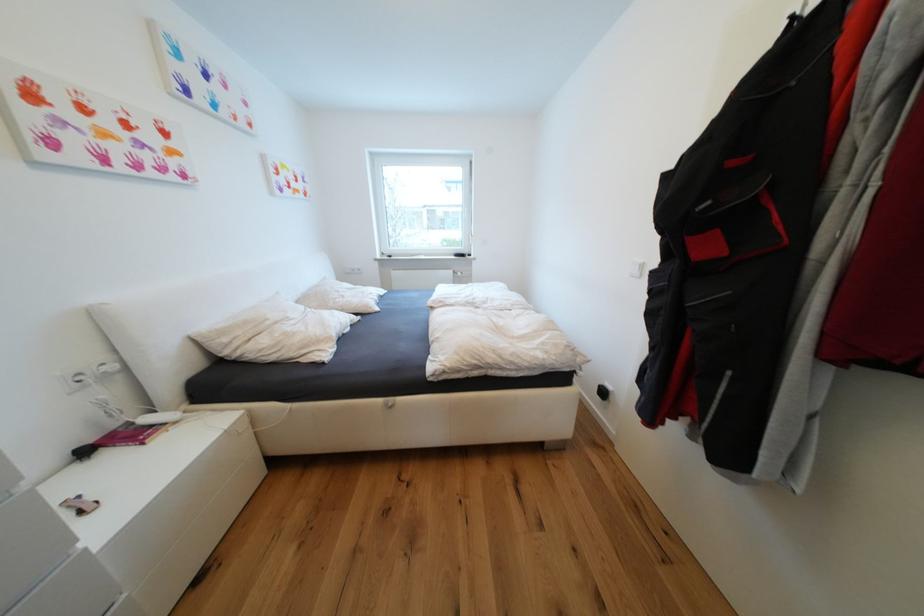
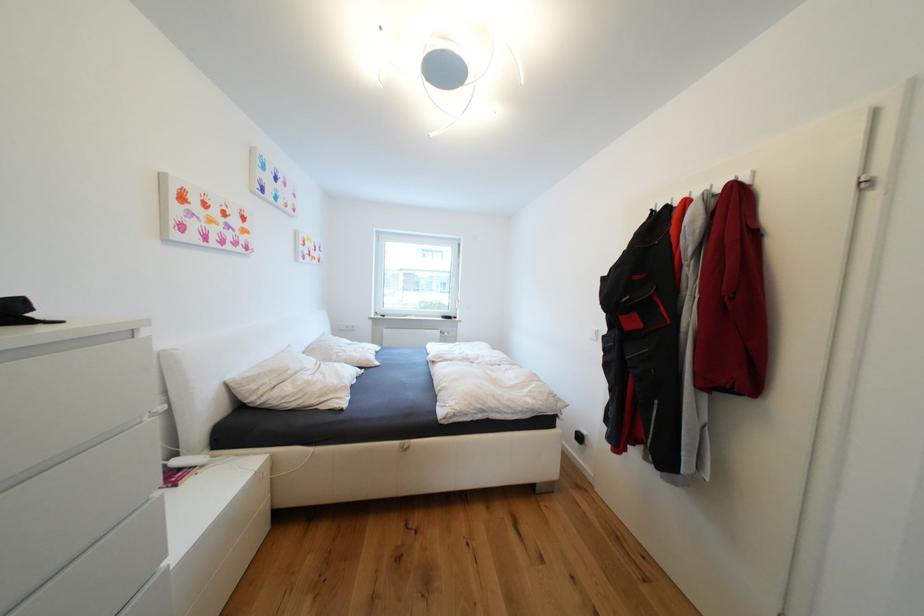
Locate, in the second image, the point that corresponds to (152,421) in the first image.

(184, 464)